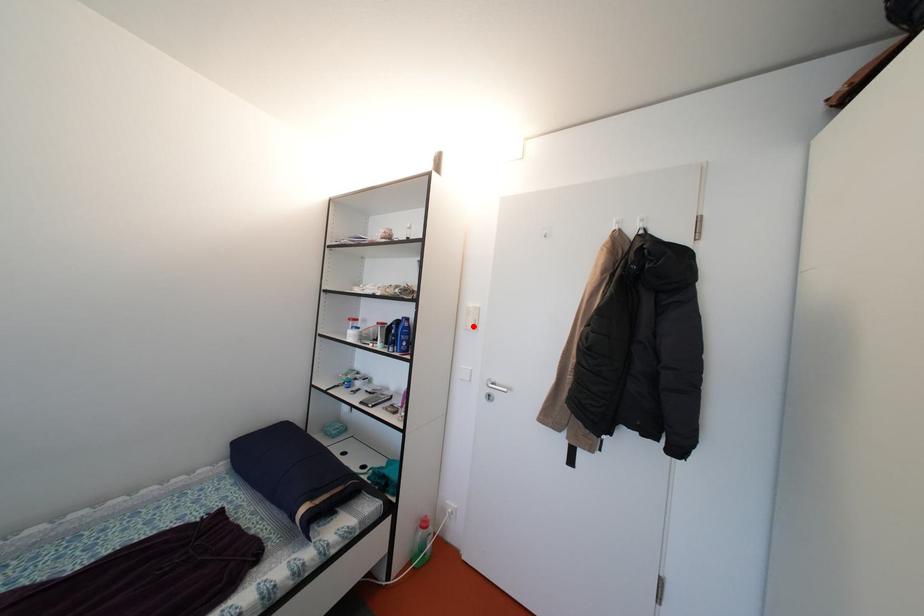
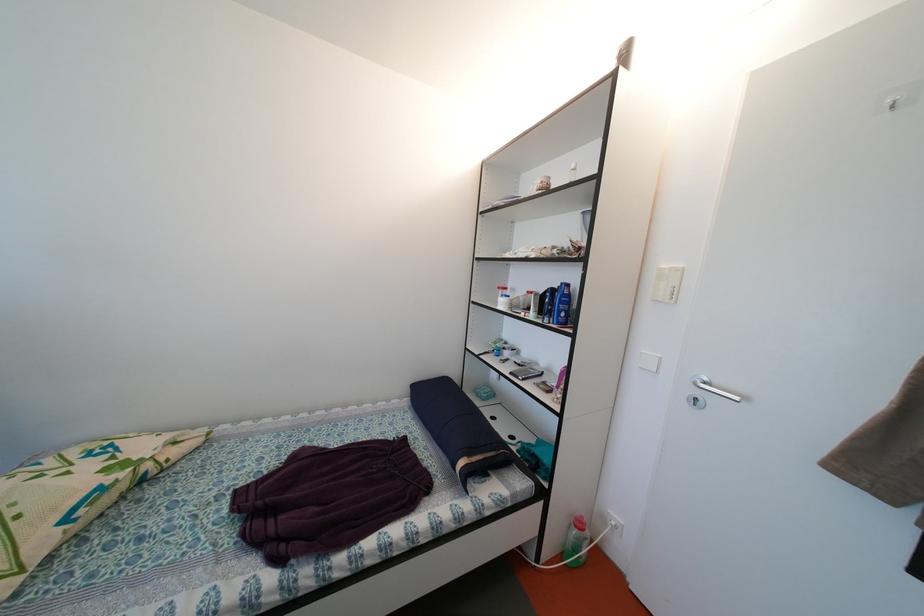
Find the pixel in the second image that matches the highlighted location in the first image.

(662, 294)